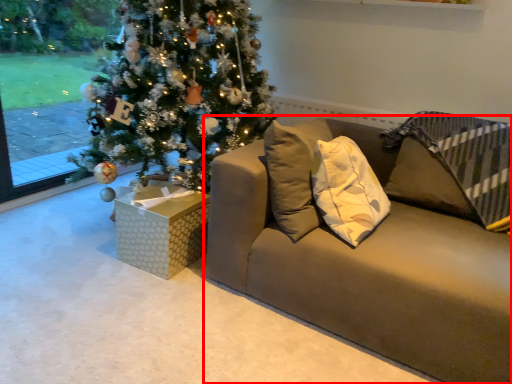
Question: From the image's perspective, what is the correct spatial relationship of studio couch (annotated by the red box) in relation to furniture?

Choices:
 (A) below
 (B) above

Answer: (B)